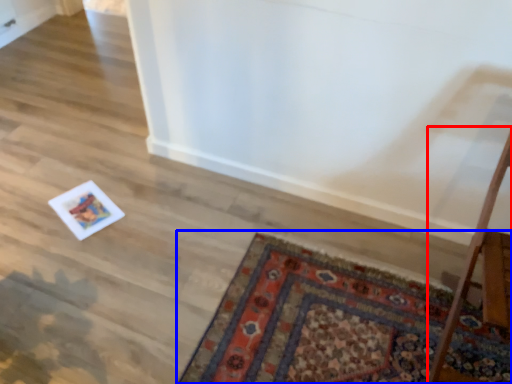
Question: Among these objects, which one is nearest to the camera, table (highlighted by a red box) or mat (highlighted by a blue box)?

Choices:
 (A) table
 (B) mat

Answer: (A)